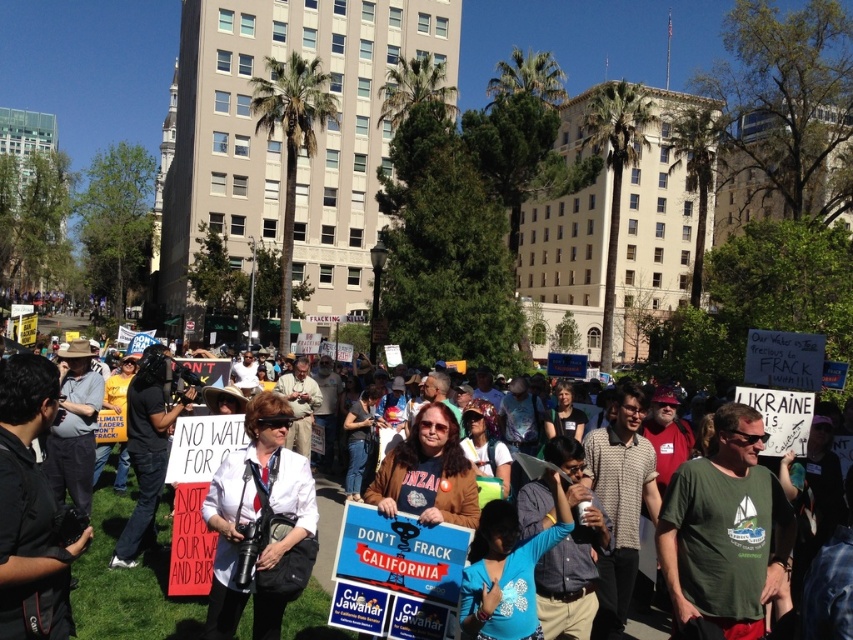
Question: Is white fabric shirt at center above white matte shirt at center?

Choices:
 (A) yes
 (B) no

Answer: (A)

Question: Does white fabric shirt at center have a greater width compared to white matte shirt at center?

Choices:
 (A) yes
 (B) no

Answer: (A)

Question: Which of the following is the closest to the observer?

Choices:
 (A) white fabric shirt at center
 (B) white matte shirt at center

Answer: (A)

Question: Is white fabric shirt at center thinner than white matte shirt at center?

Choices:
 (A) yes
 (B) no

Answer: (B)